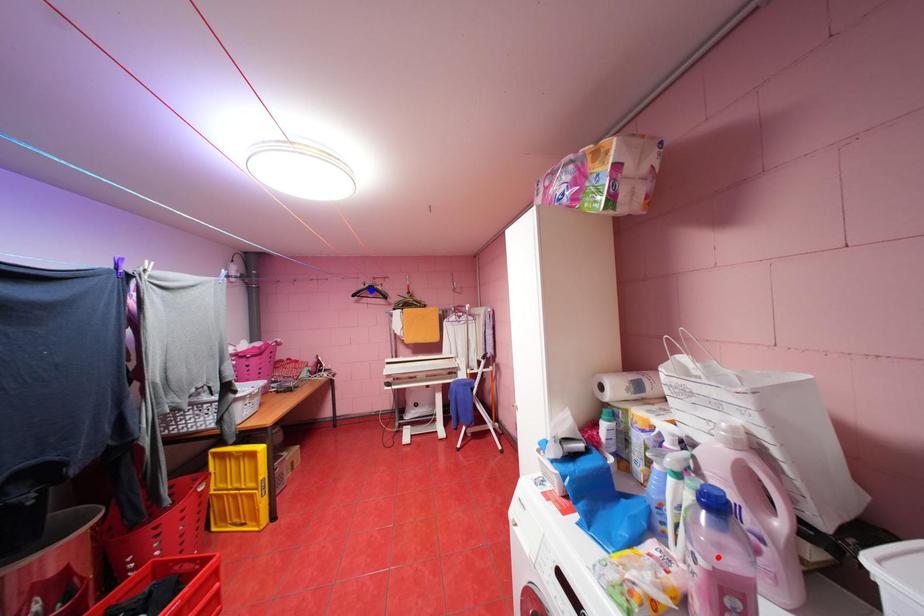
Question: In the image, two points are highlighted. Which point is nearer to the camera? Reply with the corresponding letter.

Choices:
 (A) blue point
 (B) red point

Answer: (B)